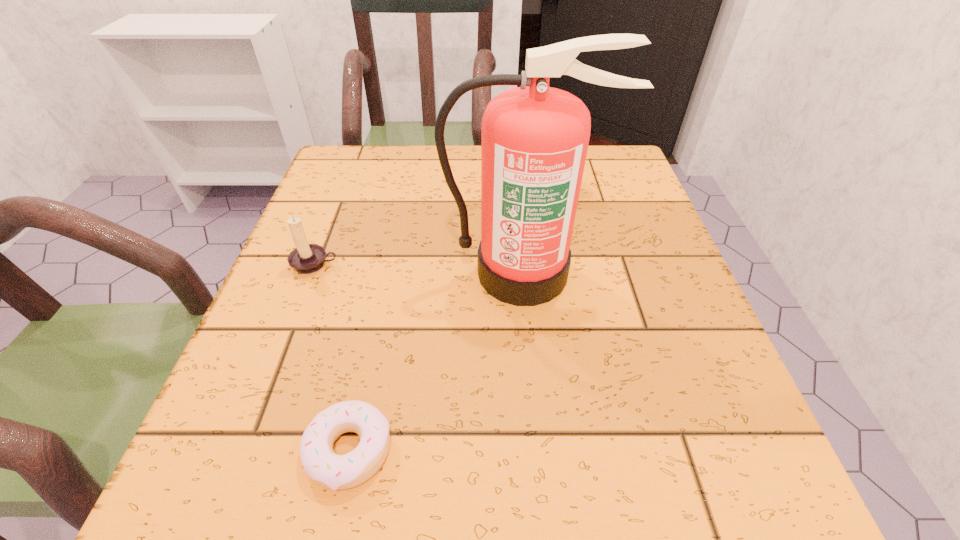
This screenshot has height=540, width=960. What are the coordinates of `candle holder situated at the left edge` in the screenshot? It's located at (306, 258).

Image resolution: width=960 pixels, height=540 pixels. Identify the location of doughnut that is positioned at the left edge. (328, 469).

Identify the location of object that is positioned at the right edge. (534, 139).

Identify the location of object present at the near left corner. This screenshot has height=540, width=960. (328, 469).

I want to click on free space at the far edge of the desktop, so click(404, 154).

This screenshot has height=540, width=960. I want to click on vacant area at the left edge, so click(x=302, y=390).

In the image, there is a desktop. Where is `vacant space at the right edge`? vacant space at the right edge is located at coordinates (666, 244).

At what (x,y) coordinates should I click in order to perform the action: click on free spot at the far left corner of the desktop. Please return your answer as a coordinate pair (x, y). Image resolution: width=960 pixels, height=540 pixels. Looking at the image, I should click on (332, 159).

Locate an element on the screen. The height and width of the screenshot is (540, 960). vacant space at the near left corner of the desktop is located at coordinates (277, 471).

Identify the location of free space between the second tallest object and the fire extinguisher. This screenshot has height=540, width=960. coord(420,269).